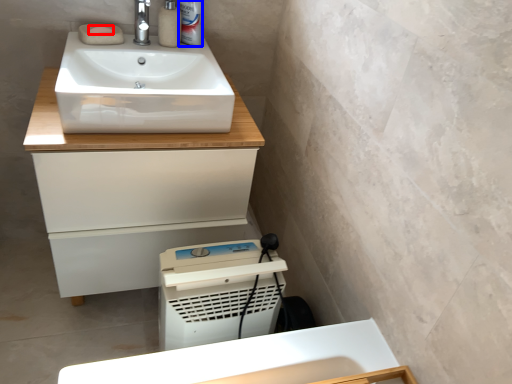
Question: Which of the following is the closest to the observer, soap (highlighted by a red box) or toiletry (highlighted by a blue box)?

Choices:
 (A) soap
 (B) toiletry

Answer: (A)